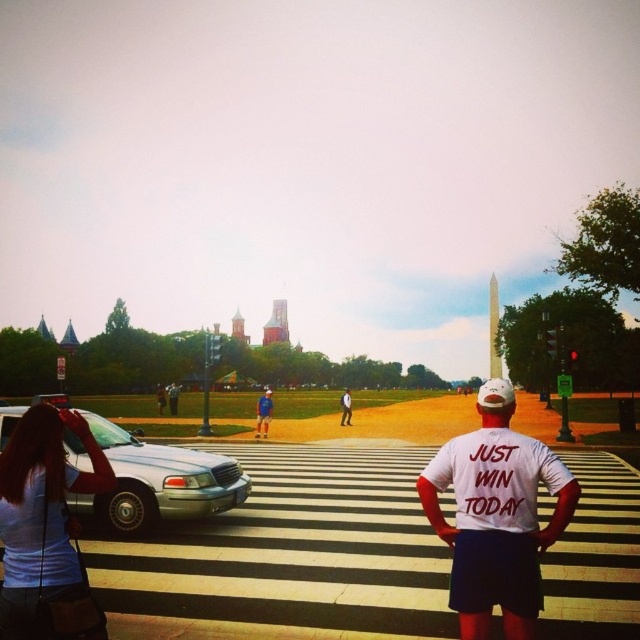
Question: Estimate the real-world distances between objects in this image. Which object is closer to the white cotton shirt at center?

Choices:
 (A) white matte shirt at center
 (B) light blue t-shirt at center-left
 (C) blue denim shorts at center

Answer: (C)

Question: Does light blue t-shirt at center-left appear under white cotton shirt at center?

Choices:
 (A) yes
 (B) no

Answer: (B)

Question: Can you confirm if white matte shirt at center is positioned below light blue t-shirt at center-left?

Choices:
 (A) yes
 (B) no

Answer: (A)

Question: Is white matte shirt at center thinner than light blue t-shirt at center-left?

Choices:
 (A) yes
 (B) no

Answer: (B)

Question: Which point appears farthest from the camera in this image?

Choices:
 (A) (493, 500)
 (B) (268, 413)
 (C) (10, 556)
 (D) (346, 420)

Answer: (D)

Question: Among these points, which one is farthest from the camera?

Choices:
 (A) (99, 440)
 (B) (170, 388)

Answer: (B)